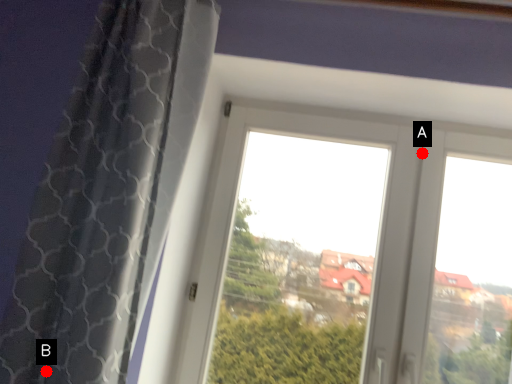
Question: Two points are circled on the image, labeled by A and B beside each circle. Which point is closer to the camera taking this photo?

Choices:
 (A) A is closer
 (B) B is closer

Answer: (B)